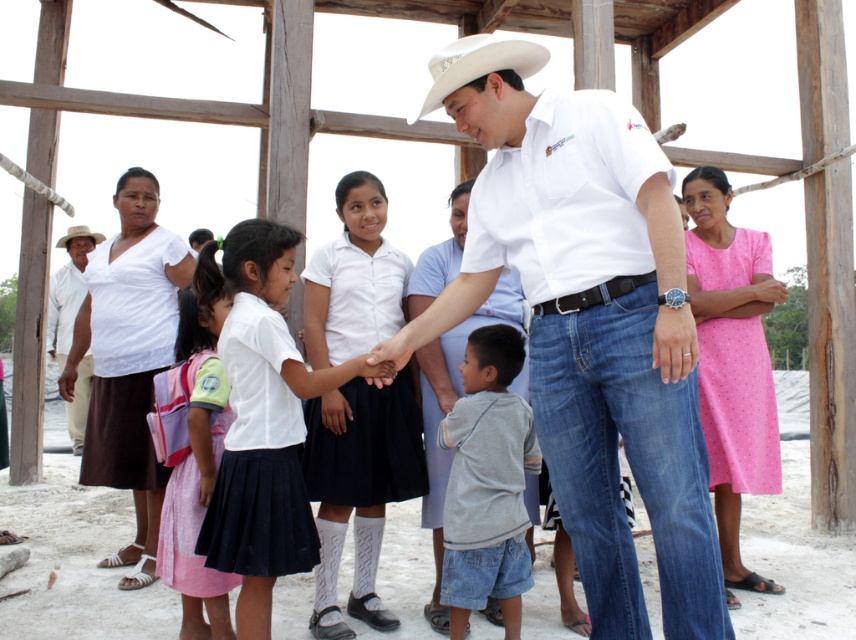
Question: Which of the following is the farthest from the observer?

Choices:
 (A) white cotton shirt at left
 (B) white matte skirt at center
 (C) white matte shirt at center

Answer: (A)

Question: Observing the image, what is the correct spatial positioning of gray cotton shirt at center in reference to white felt cowboy hat at center?

Choices:
 (A) above
 (B) below

Answer: (B)

Question: Which object appears closest to the camera in this image?

Choices:
 (A) white cotton shirt at center
 (B) white woven hat at upper left

Answer: (A)

Question: Is white uniform at center below white cotton shirt at center?

Choices:
 (A) no
 (B) yes

Answer: (A)

Question: Which object appears closest to the camera in this image?

Choices:
 (A) white felt cowboy hat at upper left
 (B) white cotton shirt at center

Answer: (B)

Question: Is white matte shirt at center to the left of white felt cowboy hat at center from the viewer's perspective?

Choices:
 (A) yes
 (B) no

Answer: (B)